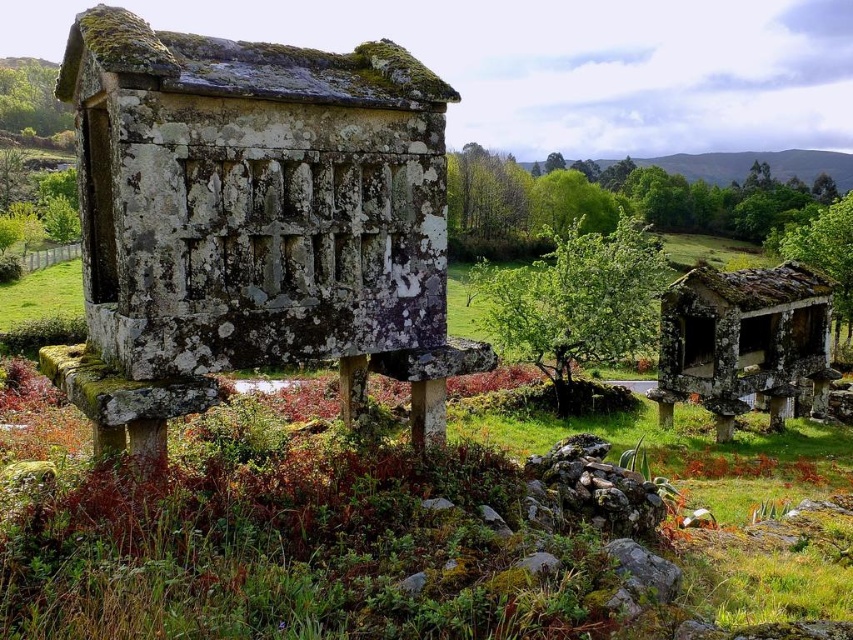
From the picture: You are standing in front of the horreo and want to take a photo. There are two points marked on the horreo structure at coordinates point (727, 333) and point (616, 289). Which point is closer to your camera position?

Point (727, 333) is closer to the camera than point (616, 289).

You are standing at the point marked as point (x=743, y=340) in the image. What is the nearest object to you?

The nearest object to you is the rusty metal hut at right located at point (x=743, y=340).

You are standing at the point marked as point (252, 221) in the image. What structure can you see directly in front of you?

The structure directly in front of you at point (252, 221) is the speckled stone hut at center.